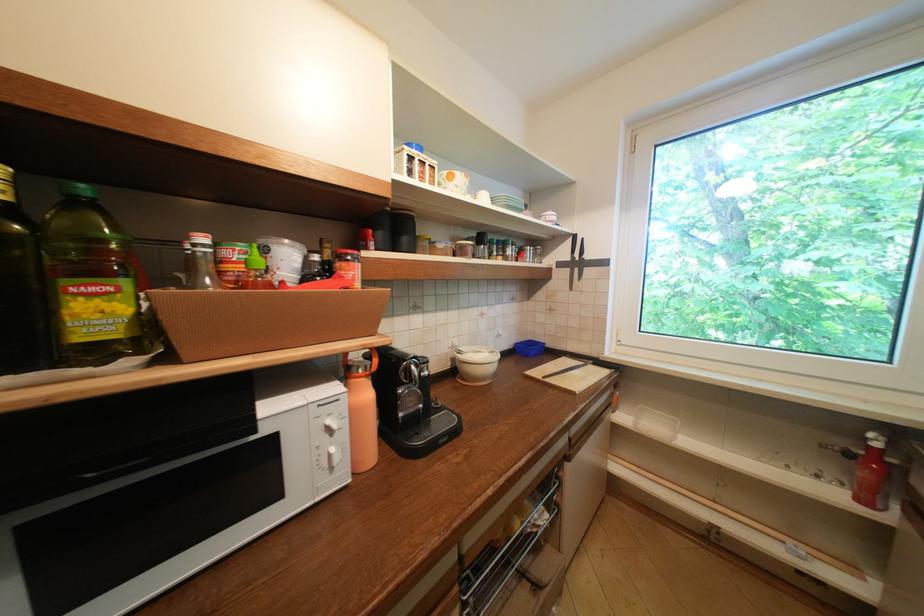
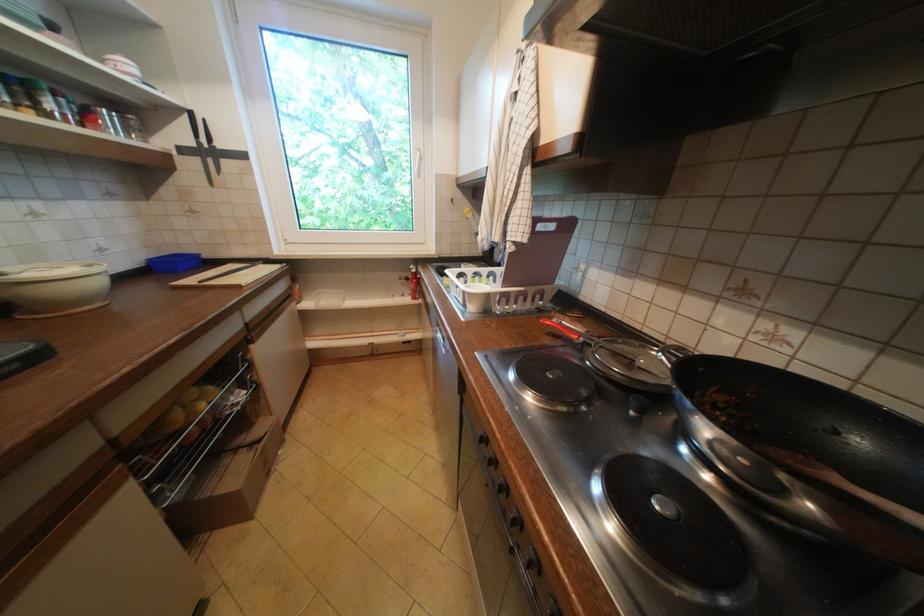
Locate, in the second image, the point that corresponds to the point at 497,353 in the first image.

(91, 267)